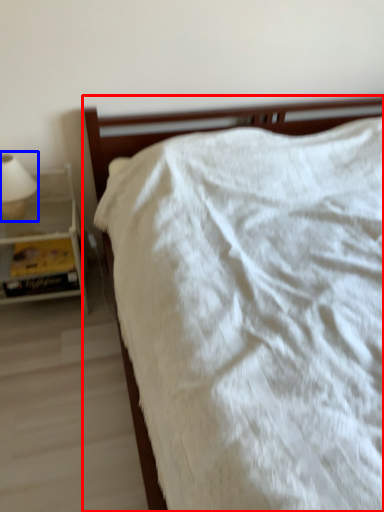
Question: Which of the following is the farthest to the observer, bed (highlighted by a red box) or bedside lamp (highlighted by a blue box)?

Choices:
 (A) bed
 (B) bedside lamp

Answer: (B)